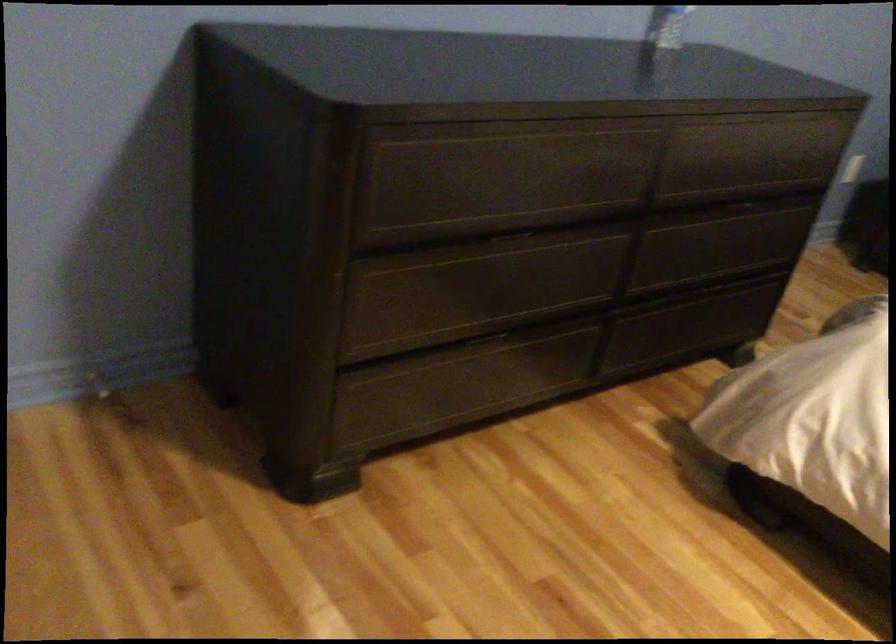
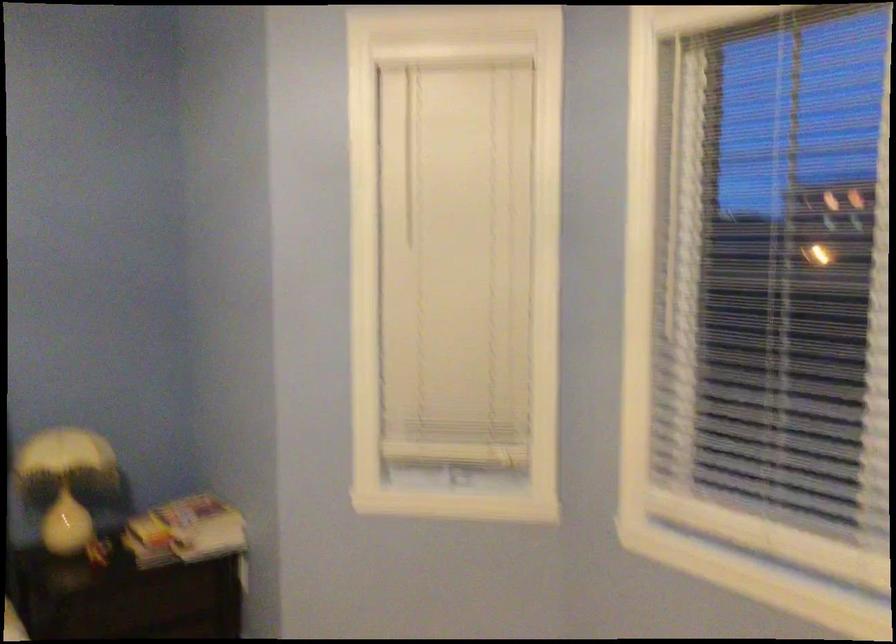
First-person continuous shooting, in which direction is the camera rotating?

The rotation direction of the camera is right-down.